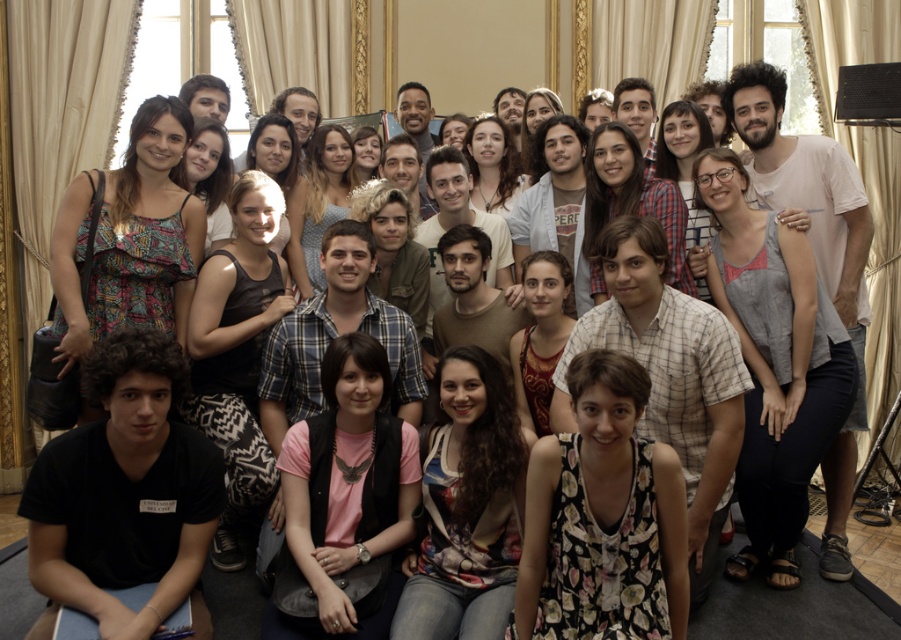
Question: Which point is closer to the camera?

Choices:
 (A) floral print top at center
 (B) pink fabric shirt at center

Answer: (A)

Question: Does pink fabric shirt at center have a larger size compared to gray fabric plaster bandage at right?

Choices:
 (A) yes
 (B) no

Answer: (A)

Question: In this image, where is floral print dress at center located relative to gray fabric plaster bandage at right?

Choices:
 (A) right
 (B) left

Answer: (B)

Question: Which point is farther to the camera?

Choices:
 (A) (422, 481)
 (B) (663, 593)

Answer: (A)

Question: Estimate the real-world distances between objects in this image. Which object is closer to the floral print top at center?

Choices:
 (A) gray fabric plaster bandage at right
 (B) floral print dress at center

Answer: (B)

Question: Does floral print dress at center appear on the left side of gray fabric plaster bandage at right?

Choices:
 (A) no
 (B) yes

Answer: (B)